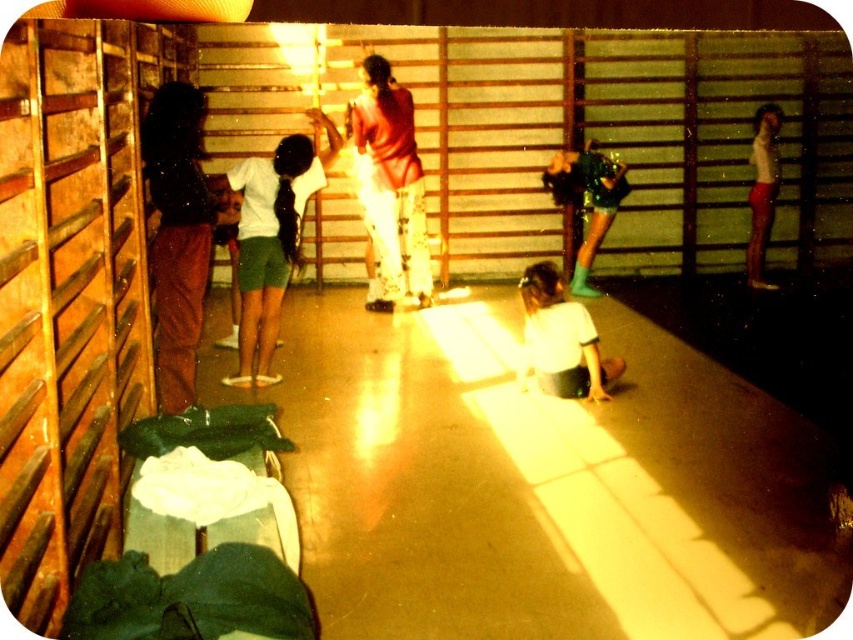
From the picture: You are a dancer preparing for a performance and need to choose between the matte brown pants at left and the shiny green boots at center. Which item is smaller in size?

The matte brown pants at left has a smaller size compared to the shiny green boots at center, so the matte brown pants at left is the smaller item.

You are a photographer setting up for a photoshoot in the dance studio. You need to position a light source to the right of the white matte shorts at center and the white matte shirt at lower center. Where should you place the light source relative to these two items?

The light source should be placed to the right of both the white matte shorts at center and the white matte shirt at lower center since the white matte shorts at center is to the left of the white matte shirt at lower center.